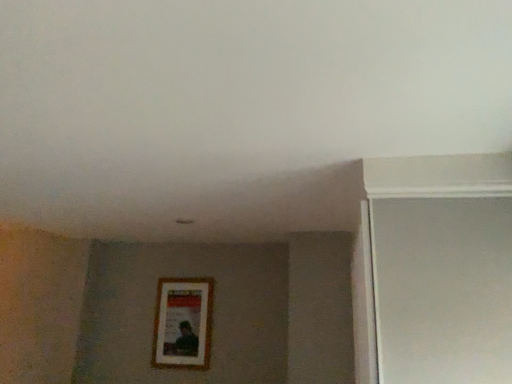
Question: Is white matte screen door at right positioned beyond the bounds of wooden picture frame at center?

Choices:
 (A) yes
 (B) no

Answer: (A)

Question: Can you confirm if white matte screen door at right is bigger than wooden picture frame at center?

Choices:
 (A) yes
 (B) no

Answer: (A)

Question: Would you consider white matte screen door at right to be distant from wooden picture frame at center?

Choices:
 (A) yes
 (B) no

Answer: (A)

Question: Does white matte screen door at right have a lesser width compared to wooden picture frame at center?

Choices:
 (A) no
 (B) yes

Answer: (A)

Question: Is white matte screen door at right oriented away from wooden picture frame at center?

Choices:
 (A) yes
 (B) no

Answer: (B)

Question: Considering the relative sizes of white matte screen door at right and wooden picture frame at center in the image provided, is white matte screen door at right taller than wooden picture frame at center?

Choices:
 (A) no
 (B) yes

Answer: (B)

Question: Is wooden picture frame at center to the left of white matte screen door at right from the viewer's perspective?

Choices:
 (A) no
 (B) yes

Answer: (B)

Question: Is wooden picture frame at center at the right side of white matte screen door at right?

Choices:
 (A) no
 (B) yes

Answer: (A)

Question: Is wooden picture frame at center thinner than white matte screen door at right?

Choices:
 (A) no
 (B) yes

Answer: (B)

Question: From a real-world perspective, is wooden picture frame at center positioned over white matte screen door at right based on gravity?

Choices:
 (A) yes
 (B) no

Answer: (B)

Question: Considering the relative sizes of wooden picture frame at center and white matte screen door at right in the image provided, is wooden picture frame at center shorter than white matte screen door at right?

Choices:
 (A) no
 (B) yes

Answer: (B)

Question: Can you confirm if wooden picture frame at center is wider than white matte screen door at right?

Choices:
 (A) yes
 (B) no

Answer: (B)

Question: Which is correct: white matte screen door at right is inside wooden picture frame at center, or outside of it?

Choices:
 (A) inside
 (B) outside

Answer: (B)